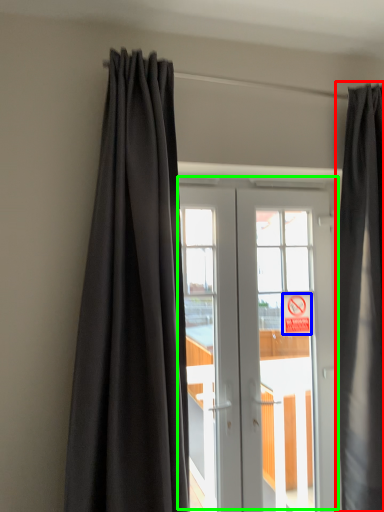
Question: Which is farther away from curtain (highlighted by a red box)? parking sign (highlighted by a blue box) or door (highlighted by a green box)?

Choices:
 (A) parking sign
 (B) door

Answer: (A)